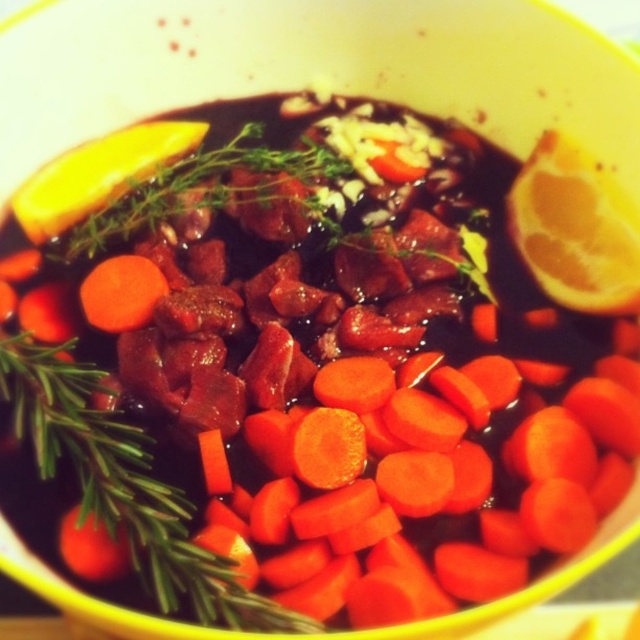
You are a chef standing 40 inches away from the yellow bowl containing the bright orange carrot at center. Can you reach the carrot without moving closer?

The bright orange carrot at center is 37.48 inches away from the viewer. Since you are standing 40 inches away, you are slightly farther than the carrot, so you cannot reach it without moving closer.

You are a chef preparing a dish and need to place the matte yellow lemon at upper right and the orange smooth carrot at center onto a small plate. The plate can only hold items that are smaller than 10 cm in diameter. Based on the image, will both items fit on the plate?

The matte yellow lemon at upper right is larger in size than the orange smooth carrot at center. Since the plate can only hold items smaller than 10 cm in diameter, we need to know the exact size of the lemon. However, the description only states their relative sizes. Without specific measurements, we can only confirm that the carrot is smaller than the lemon. If the lemon is over 10 cm, the carrot might still fit if it is under 10 cm, but we cannot be certain without more information.

What is the 2D coordinate of the matte yellow lemon at upper right in the image?

The matte yellow lemon at upper right is located at the 2D coordinate point of (576, 228).